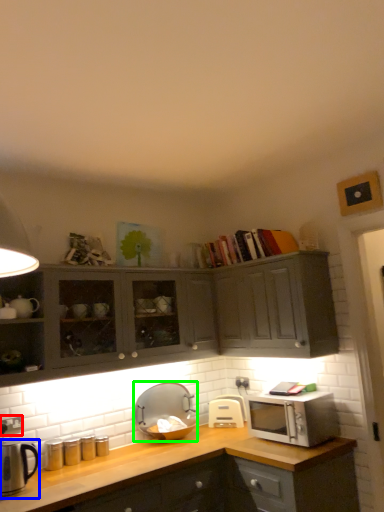
Question: Which object is positioned farthest from electric outlet (highlighted by a red box)? Select from appliance (highlighted by a blue box) and appliance (highlighted by a green box).

Choices:
 (A) appliance
 (B) appliance

Answer: (B)